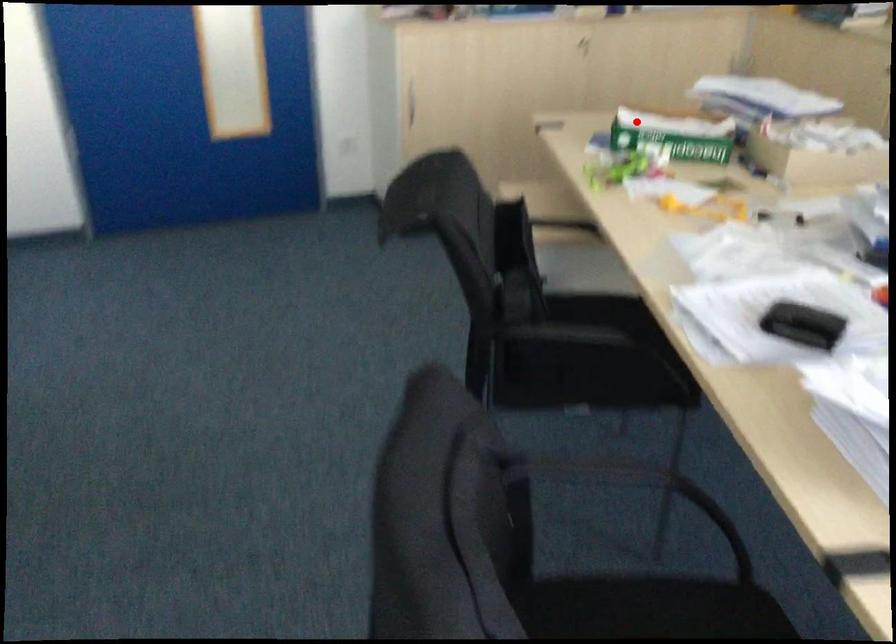
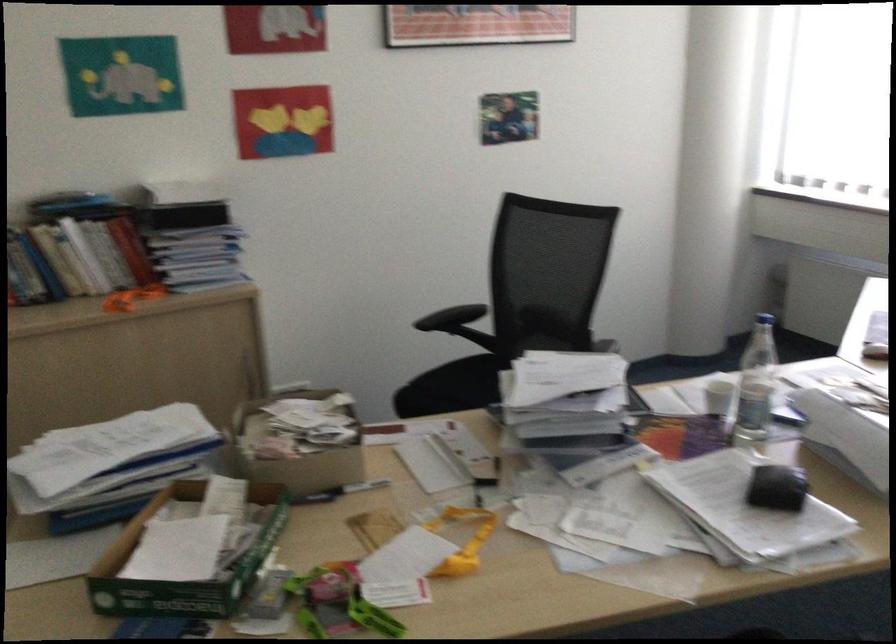
Where in the second image is the point corresponding to the highlighted location from the first image?

(184, 564)